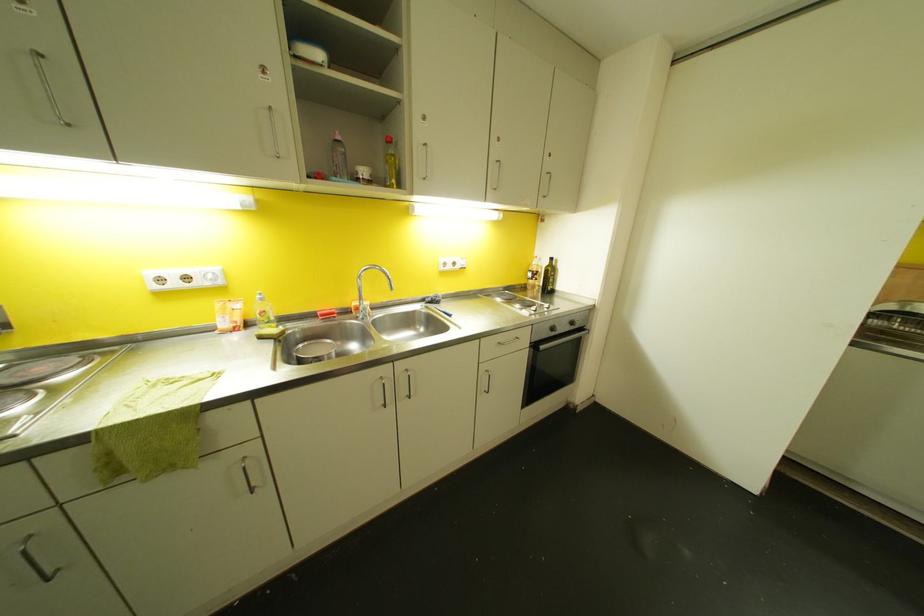
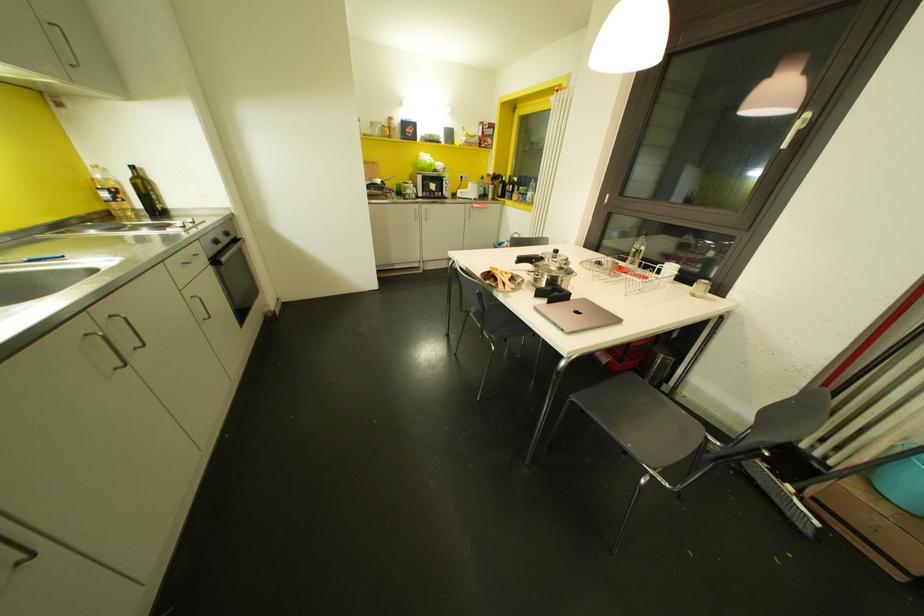
Consider the image. How did the camera likely rotate?

The rotation direction of the camera is right-down.